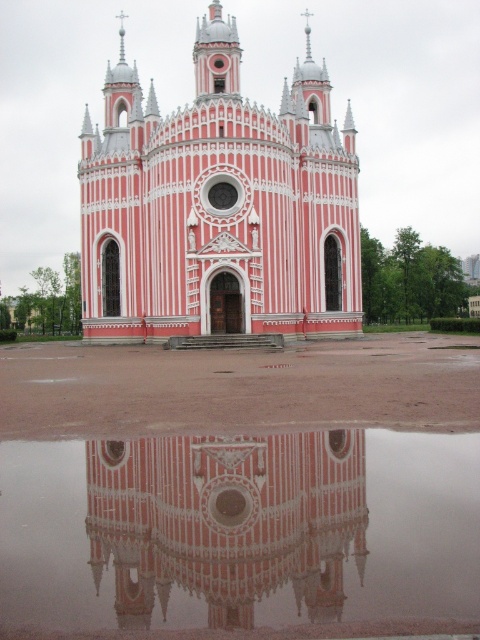
Is the position of pink polished stone church at center less distant than that of pink glossy building at center?

No, it is not.

Who is more distant from viewer, (223, 67) or (261, 556)?

Point (223, 67)

Identify the location of pink polished stone church at center. The image size is (480, 640). coord(218,205).